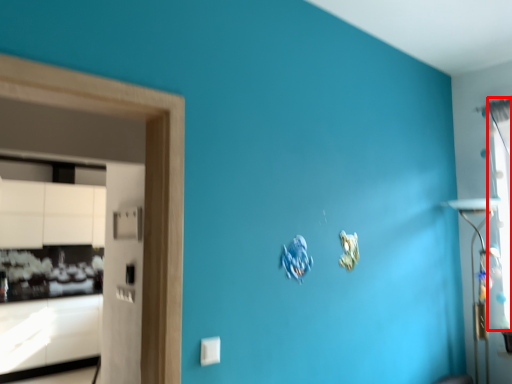
Question: From the image, what is the correct spatial relationship of window (annotated by the red box) in relation to cabinetry?

Choices:
 (A) right
 (B) left

Answer: (A)